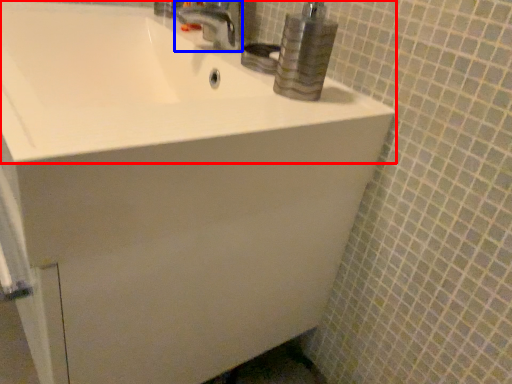
Question: Which object is closer to the camera taking this photo, sink (highlighted by a red box) or tap (highlighted by a blue box)?

Choices:
 (A) sink
 (B) tap

Answer: (A)